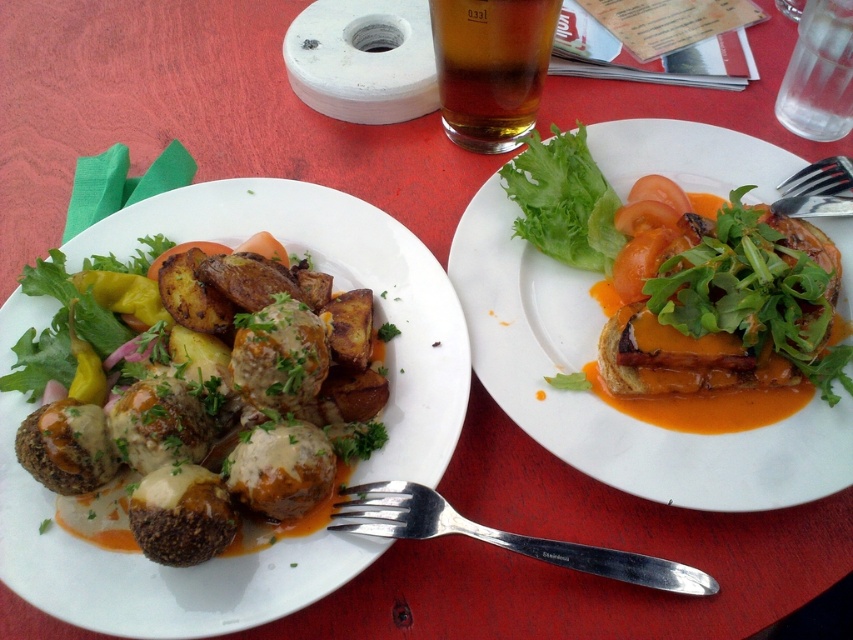
The height and width of the screenshot is (640, 853). What do you see at coordinates (334, 292) in the screenshot?
I see `brown matte meatballs at left` at bounding box center [334, 292].

Identify the location of brown matte meatballs at left. The height and width of the screenshot is (640, 853). (334, 292).

Between point (611, 426) and point (450, 44), which one is positioned behind?

The point (450, 44) is behind.

Between matte white plate at center and brown translucent glass at upper center, which one appears on the right side from the viewer's perspective?

From the viewer's perspective, matte white plate at center appears more on the right side.

Is point (634, 134) farther from viewer compared to point (509, 29)?

Yes, point (634, 134) is behind point (509, 29).

This screenshot has height=640, width=853. In order to click on matte white plate at center in this screenshot , I will do `click(604, 403)`.

Can you confirm if silver metallic fork at lower left is positioned above silver metallic fork at upper right?

Incorrect, silver metallic fork at lower left is not positioned above silver metallic fork at upper right.

This screenshot has height=640, width=853. Identify the location of silver metallic fork at lower left. tap(500, 536).